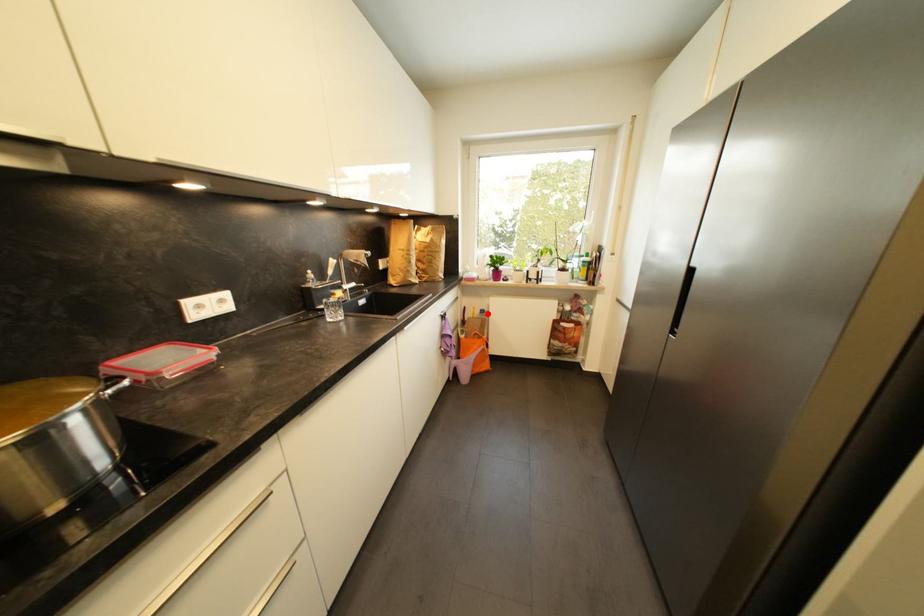
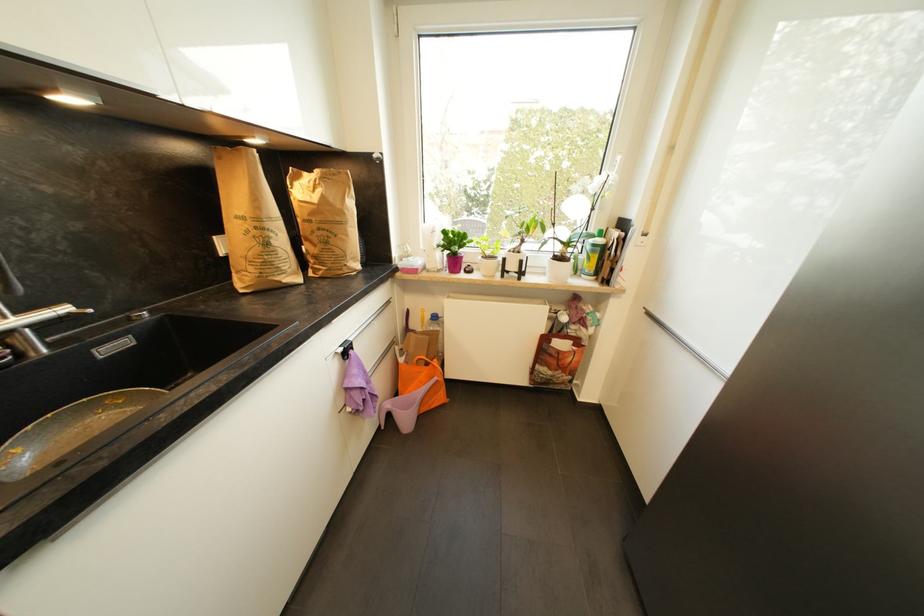
Question: A red point is marked in image1. In image2, is the corresponding 3D point closer to the camera or farther? Reply with the corresponding letter.

Choices:
 (A) The corresponding 3D point is closer.
 (B) The corresponding 3D point is farther.

Answer: (A)